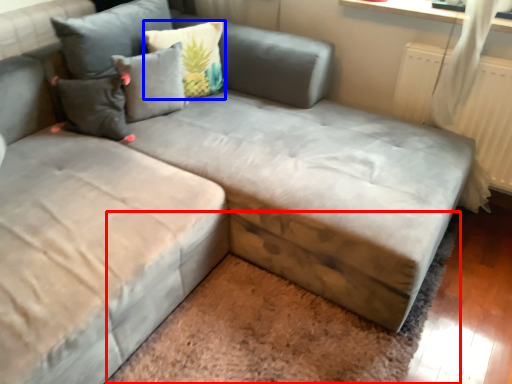
Question: Which point is further to the camera, mat (highlighted by a red box) or pillow (highlighted by a blue box)?

Choices:
 (A) mat
 (B) pillow

Answer: (B)